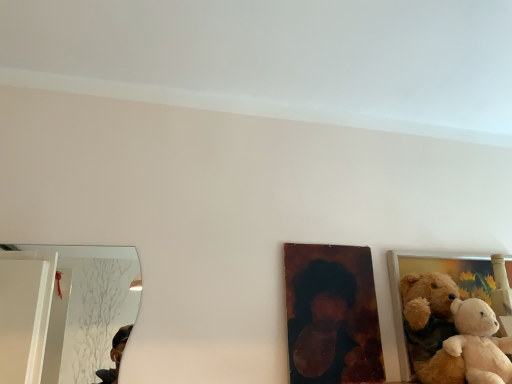
Question: From a real-world perspective, is fluffy fabric teddy bear at right, which is the 2th picture frame from left to right, positioned above or below soft beige plush at right?

Choices:
 (A) below
 (B) above

Answer: (B)

Question: Is fluffy fabric teddy bear at right, which ranks as the 1th picture frame in right-to-left order, wider or thinner than soft beige plush at right?

Choices:
 (A) wide
 (B) thin

Answer: (B)

Question: Which object is the closest to the fluffy fabric teddy bear at right, which ranks as the 1th picture frame in right-to-left order?

Choices:
 (A) wooden portrait at center, the first picture frame in the left-to-right sequence
 (B) soft beige plush at right

Answer: (A)

Question: Which object is positioned closest to the wooden portrait at center, the first picture frame in the left-to-right sequence?

Choices:
 (A) fluffy fabric teddy bear at right, which is the 2th picture frame from left to right
 (B) soft beige plush at right

Answer: (A)